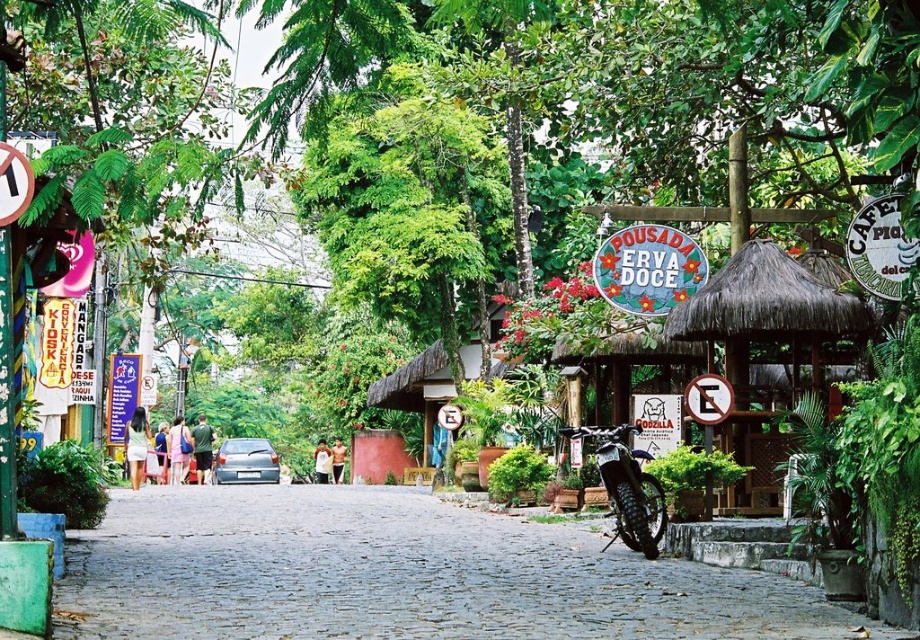
Question: Which object appears closest to the camera in this image?

Choices:
 (A) thatched roof hut at center
 (B) silver metallic car at center
 (C) metallic silver motorcycle at center

Answer: (C)

Question: Does thatched roof hut at center have a larger size compared to metallic silver motorcycle at center?

Choices:
 (A) no
 (B) yes

Answer: (B)

Question: Which object is the farthest from the thatched roof hut at center?

Choices:
 (A) silver metallic car at center
 (B) metallic silver motorcycle at center

Answer: (A)

Question: Is thatched roof hut at center positioned behind metallic silver motorcycle at center?

Choices:
 (A) yes
 (B) no

Answer: (A)

Question: Estimate the real-world distances between objects in this image. Which object is farther from the silver metallic car at center?

Choices:
 (A) metallic silver motorcycle at center
 (B) thatched roof hut at center

Answer: (B)

Question: Can you confirm if thatched roof hut at center is positioned below silver metallic car at center?

Choices:
 (A) yes
 (B) no

Answer: (B)